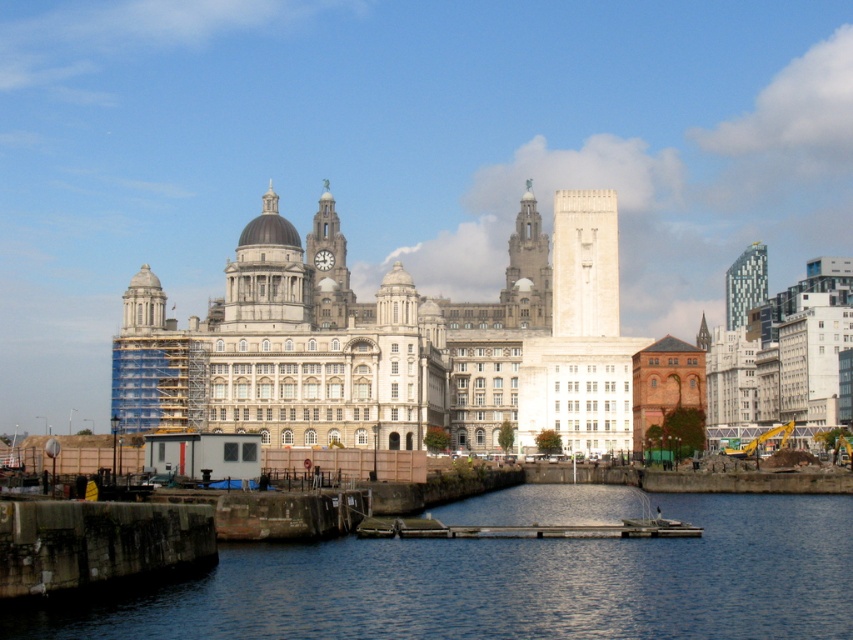
Does white stone tower at center have a lesser width compared to white stone dome at center?

Yes.

Measure the distance between white stone tower at center and camera.

white stone tower at center and camera are 136.66 meters apart from each other.

The height and width of the screenshot is (640, 853). I want to click on white stone tower at center, so click(x=584, y=262).

Who is more forward, (241, 314) or (325, 324)?

Point (241, 314) is more forward.

Is white stone dome at center below white stone clock tower at center?

No, white stone dome at center is not below white stone clock tower at center.

Who is more distant from viewer, (310, 291) or (334, 273)?

The point (334, 273) is behind.

In order to click on white stone dome at center in this screenshot , I will do `click(267, 272)`.

Does white stone dome at center have a smaller size compared to wooden dock at lower center?

Incorrect, white stone dome at center is not smaller in size than wooden dock at lower center.

Consider the image. Who is more forward, (302, 291) or (693, 529)?

Point (693, 529) is in front.

Between point (260, 225) and point (683, 531), which one is positioned in front?

Point (683, 531)

The height and width of the screenshot is (640, 853). Find the location of `white stone dome at center`. white stone dome at center is located at coordinates (267, 272).